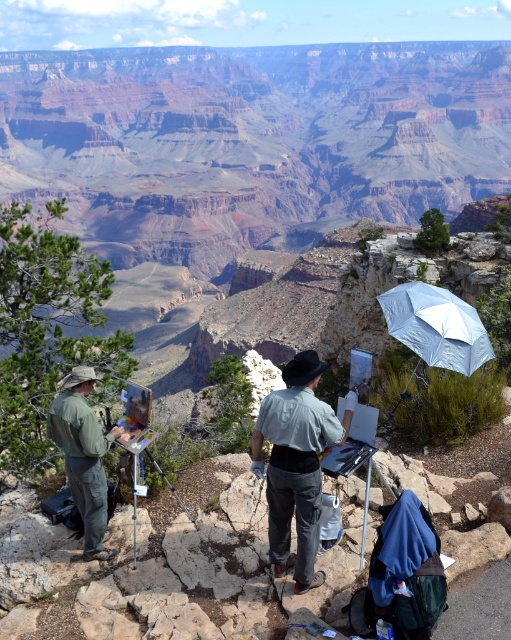
Between point (96, 461) and point (463, 332), which one is positioned in front?

Point (96, 461) is more forward.

This screenshot has width=511, height=640. In order to click on green matte uniform at center in this screenshot , I will do `click(83, 456)`.

Who is positioned more to the left, light blue denim shirt at center or green matte uniform at center?

green matte uniform at center is more to the left.

Describe the element at coordinates (296, 464) in the screenshot. I see `light blue denim shirt at center` at that location.

At what (x,y) coordinates should I click in order to perform the action: click on light blue denim shirt at center. Please return your answer as a coordinate pair (x, y). Looking at the image, I should click on (296, 464).

Does point (313, 582) come closer to viewer compared to point (466, 321)?

Yes, it is in front of point (466, 321).

You are a GUI agent. You are given a task and a screenshot of the screen. Output one action in this format:
    pyautogui.click(x=<x>, y=<y>)
    Task: Click on the light blue denim shirt at center
    
    Given the screenshot: What is the action you would take?
    pyautogui.click(x=296, y=464)